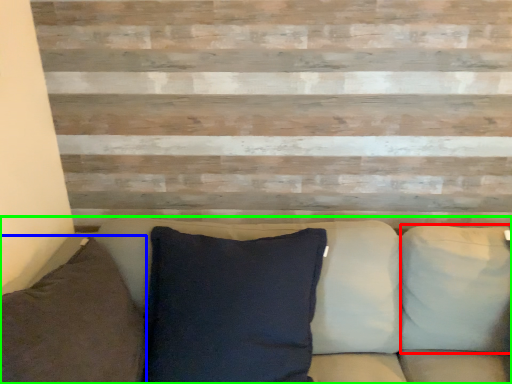
Question: Estimate the real-world distances between objects in this image. Which object is closer to pillow (highlighted by a red box), pillow (highlighted by a blue box) or studio couch (highlighted by a green box)?

Choices:
 (A) pillow
 (B) studio couch

Answer: (B)